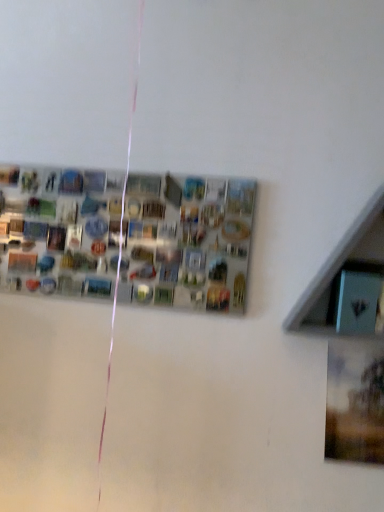
Question: Can you confirm if metallic silver bulletin board at center is thinner than blue glossy shelf at upper right?

Choices:
 (A) yes
 (B) no

Answer: (A)

Question: Is metallic silver bulletin board at center to the left of blue glossy shelf at upper right from the viewer's perspective?

Choices:
 (A) yes
 (B) no

Answer: (A)

Question: Considering the relative sizes of metallic silver bulletin board at center and blue glossy shelf at upper right in the image provided, is metallic silver bulletin board at center taller than blue glossy shelf at upper right?

Choices:
 (A) no
 (B) yes

Answer: (A)

Question: From a real-world perspective, is metallic silver bulletin board at center physically above blue glossy shelf at upper right?

Choices:
 (A) no
 (B) yes

Answer: (A)

Question: Is metallic silver bulletin board at center next to blue glossy shelf at upper right and touching it?

Choices:
 (A) no
 (B) yes

Answer: (A)

Question: Is metallic silver bulletin board at center smaller than blue glossy shelf at upper right?

Choices:
 (A) no
 (B) yes

Answer: (B)

Question: Is blue glossy shelf at upper right further to the viewer compared to metallic silver bulletin board at center?

Choices:
 (A) no
 (B) yes

Answer: (A)

Question: Is blue glossy shelf at upper right outside metallic silver bulletin board at center?

Choices:
 (A) no
 (B) yes

Answer: (B)

Question: Would you say metallic silver bulletin board at center is part of blue glossy shelf at upper right's contents?

Choices:
 (A) no
 (B) yes

Answer: (A)

Question: Is the depth of blue glossy shelf at upper right less than that of metallic silver bulletin board at center?

Choices:
 (A) yes
 (B) no

Answer: (A)

Question: Considering the relative sizes of blue glossy shelf at upper right and metallic silver bulletin board at center in the image provided, is blue glossy shelf at upper right taller than metallic silver bulletin board at center?

Choices:
 (A) no
 (B) yes

Answer: (B)

Question: Can you confirm if blue glossy shelf at upper right is positioned to the left of metallic silver bulletin board at center?

Choices:
 (A) yes
 (B) no

Answer: (B)

Question: In terms of height, does blue glossy shelf at upper right look taller or shorter compared to metallic silver bulletin board at center?

Choices:
 (A) tall
 (B) short

Answer: (A)